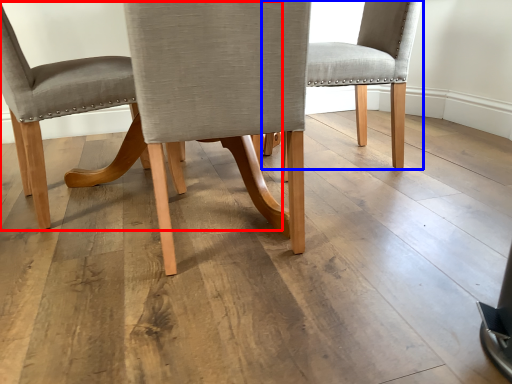
Question: Which of the following is the closest to the observer, chair (highlighted by a red box) or chair (highlighted by a blue box)?

Choices:
 (A) chair
 (B) chair

Answer: (A)